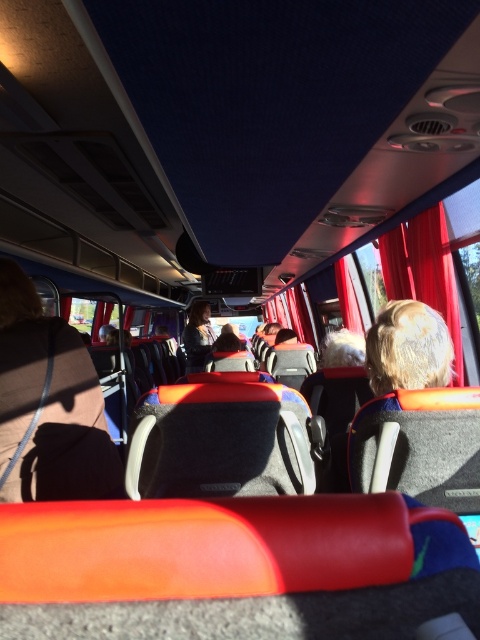
Looking at this image, which is more to the right, brown leather coach at lower left or blonde hair at upper right?

Positioned to the right is blonde hair at upper right.

Can you confirm if brown leather coach at lower left is positioned to the right of blonde hair at upper right?

In fact, brown leather coach at lower left is to the left of blonde hair at upper right.

This screenshot has width=480, height=640. Describe the element at coordinates (48, 404) in the screenshot. I see `brown leather coach at lower left` at that location.

At what (x,y) coordinates should I click in order to perform the action: click on brown leather coach at lower left. Please return your answer as a coordinate pair (x, y). The image size is (480, 640). Looking at the image, I should click on (48, 404).

Between red fabric curtain at upper right and dark blue fabric jacket at center, which one is positioned higher?

red fabric curtain at upper right

Looking at this image, does red fabric curtain at upper right have a greater width compared to dark blue fabric jacket at center?

Incorrect, red fabric curtain at upper right's width does not surpass dark blue fabric jacket at center's.

You are a GUI agent. You are given a task and a screenshot of the screen. Output one action in this format:
    pyautogui.click(x=<x>, y=<y>)
    Task: Click on the red fabric curtain at upper right
    This screenshot has height=640, width=480.
    Given the screenshot: What is the action you would take?
    pyautogui.click(x=423, y=272)

Who is taller, brown leather coach at lower left or red fabric curtain at upper right?

red fabric curtain at upper right

Is point (48, 392) in front of point (383, 241)?

Yes, it is in front of point (383, 241).

In order to click on brown leather coach at lower left in this screenshot , I will do pyautogui.click(x=48, y=404).